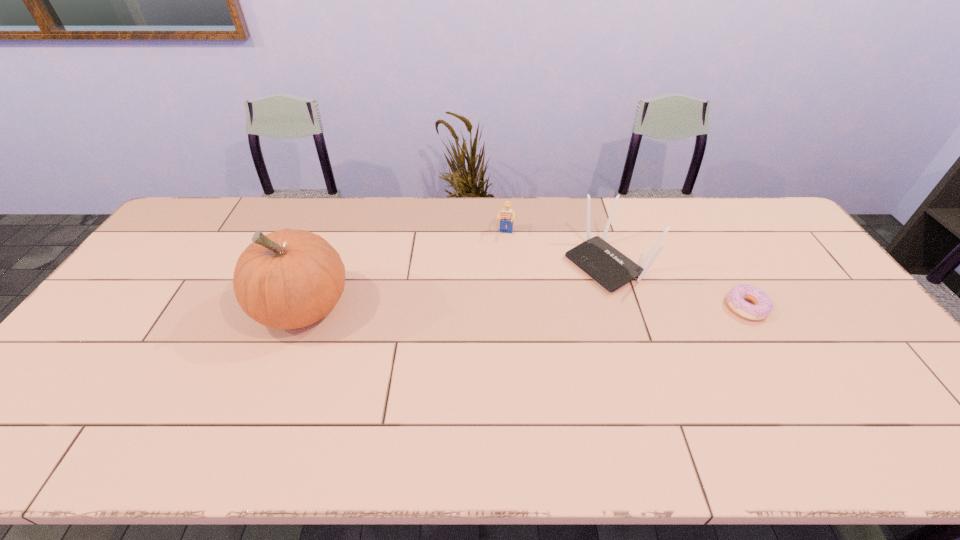
This screenshot has height=540, width=960. What are the coordinates of `vacant region at the far edge of the desktop` in the screenshot? It's located at (703, 227).

Identify the location of blank space at the near edge of the desktop. (361, 409).

Where is `vacant space at the left edge of the desktop`? The height and width of the screenshot is (540, 960). vacant space at the left edge of the desktop is located at coordinates coord(166,293).

In the image, there is a desktop. Where is `free region at the right edge`? The image size is (960, 540). free region at the right edge is located at coordinates click(x=818, y=341).

You are a GUI agent. You are given a task and a screenshot of the screen. Output one action in this format:
    pyautogui.click(x=<x>, y=<y>)
    Task: Click on the vacant region at the far left corner of the desktop
    The image size is (960, 540).
    Given the screenshot: What is the action you would take?
    pyautogui.click(x=184, y=215)

The height and width of the screenshot is (540, 960). What are the coordinates of `free space at the far right corner` in the screenshot? It's located at (762, 231).

You are a GUI agent. You are given a task and a screenshot of the screen. Output one action in this format:
    pyautogui.click(x=<x>, y=<y>)
    Task: Click on the blank region between the second object from right to left and the shortest object
    This screenshot has width=960, height=540.
    Given the screenshot: What is the action you would take?
    pyautogui.click(x=678, y=286)

This screenshot has height=540, width=960. Identify the location of free space between the tallest object and the second object from right to left. (456, 286).

Image resolution: width=960 pixels, height=540 pixels. I want to click on free space that is in between the second object from left to right and the leftmost object, so click(x=404, y=271).

The height and width of the screenshot is (540, 960). In order to click on blank region between the third object from left to right and the rightmost object in this screenshot , I will do `click(678, 286)`.